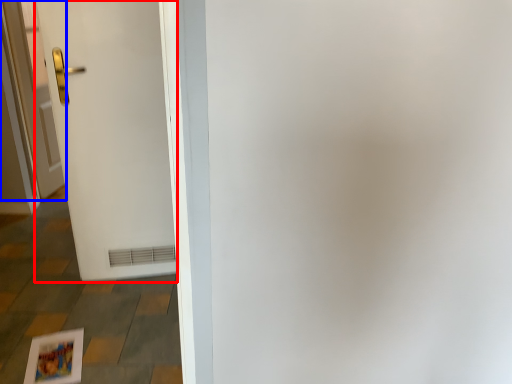
Question: Which of the following is the farthest to the observer, door (highlighted by a red box) or door (highlighted by a blue box)?

Choices:
 (A) door
 (B) door

Answer: (B)